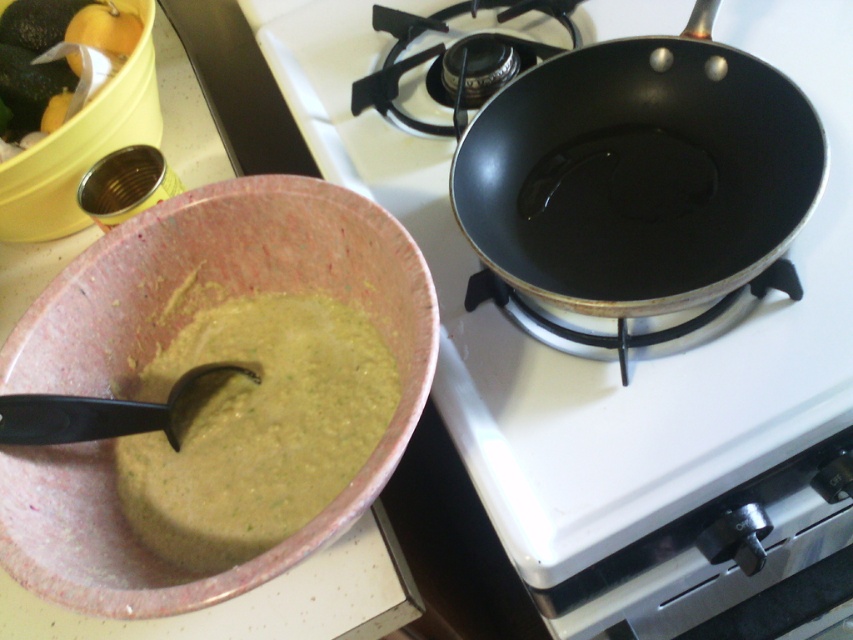
Question: Does black matte pan at upper right appear under green matte soup at lower left?

Choices:
 (A) yes
 (B) no

Answer: (B)

Question: Can you confirm if pink speckled bowl at lower left is positioned above black non-stick frying pan at upper right?

Choices:
 (A) no
 (B) yes

Answer: (A)

Question: Does pink speckled bowl at lower left have a smaller size compared to black non-stick frying pan at upper right?

Choices:
 (A) yes
 (B) no

Answer: (B)

Question: Based on their relative distances, which object is nearer to the pink speckled bowl at lower left?

Choices:
 (A) black plastic spoon at lower left
 (B) black matte pan at upper right
 (C) green matte soup at lower left

Answer: (C)

Question: Based on their relative distances, which object is nearer to the black plastic spoon at lower left?

Choices:
 (A) black non-stick frying pan at upper right
 (B) green matte avocado at upper left

Answer: (A)

Question: Which point is closer to the camera?

Choices:
 (A) (36, 544)
 (B) (584, 132)

Answer: (A)